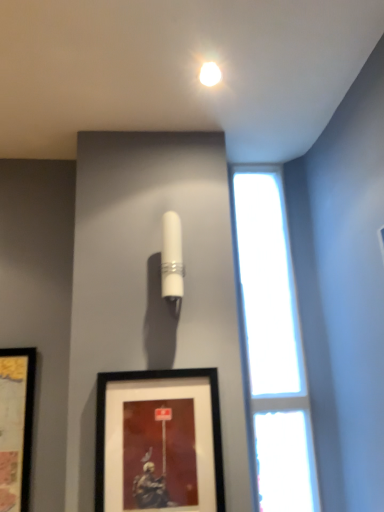
Question: Is white glossy cylinder at upper center far away from black matte picture frame at lower center?

Choices:
 (A) no
 (B) yes

Answer: (A)

Question: Does white glossy cylinder at upper center have a smaller size compared to black matte picture frame at lower center?

Choices:
 (A) no
 (B) yes

Answer: (B)

Question: Can you confirm if white glossy cylinder at upper center is positioned to the right of black matte picture frame at lower center?

Choices:
 (A) yes
 (B) no

Answer: (A)

Question: Is white glossy cylinder at upper center outside of black matte picture frame at lower center?

Choices:
 (A) yes
 (B) no

Answer: (A)

Question: Is white glossy cylinder at upper center wider than black matte picture frame at lower center?

Choices:
 (A) no
 (B) yes

Answer: (B)

Question: From a real-world perspective, is white glossy cylinder at upper center on top of black matte picture frame at lower center?

Choices:
 (A) yes
 (B) no

Answer: (A)

Question: Is the depth of black matte picture frame at lower center greater than that of white glossy cylinder at upper center?

Choices:
 (A) no
 (B) yes

Answer: (A)

Question: Considering the relative sizes of black matte picture frame at lower center and white glossy cylinder at upper center in the image provided, is black matte picture frame at lower center smaller than white glossy cylinder at upper center?

Choices:
 (A) yes
 (B) no

Answer: (B)

Question: From a real-world perspective, is black matte picture frame at lower center positioned over white glossy cylinder at upper center based on gravity?

Choices:
 (A) yes
 (B) no

Answer: (B)

Question: Is black matte picture frame at lower center at the left side of white glossy cylinder at upper center?

Choices:
 (A) no
 (B) yes

Answer: (B)

Question: Is black matte picture frame at lower center positioned with its back to white glossy cylinder at upper center?

Choices:
 (A) yes
 (B) no

Answer: (B)

Question: From a real-world perspective, is black matte picture frame at lower center located beneath white glossy cylinder at upper center?

Choices:
 (A) no
 (B) yes

Answer: (B)

Question: Is white glossy cylinder at upper center positioned far away from transparent glass window at right?

Choices:
 (A) yes
 (B) no

Answer: (B)